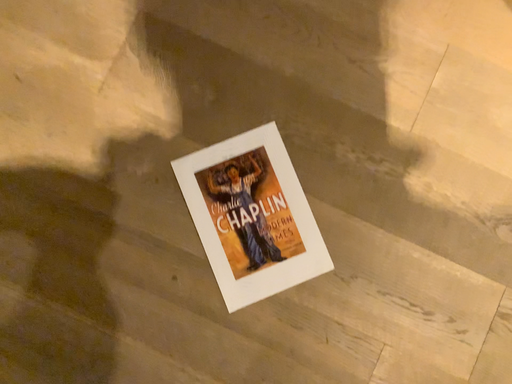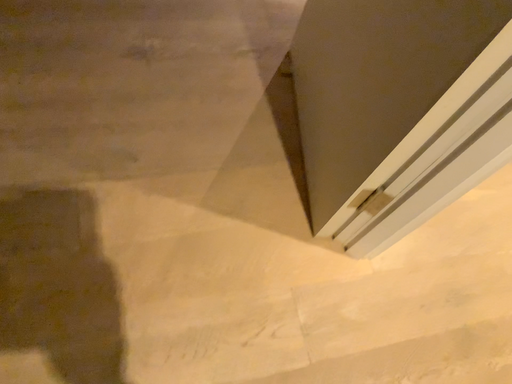
Question: How did the camera likely rotate when shooting the video?

Choices:
 (A) rotated left
 (B) rotated right

Answer: (B)